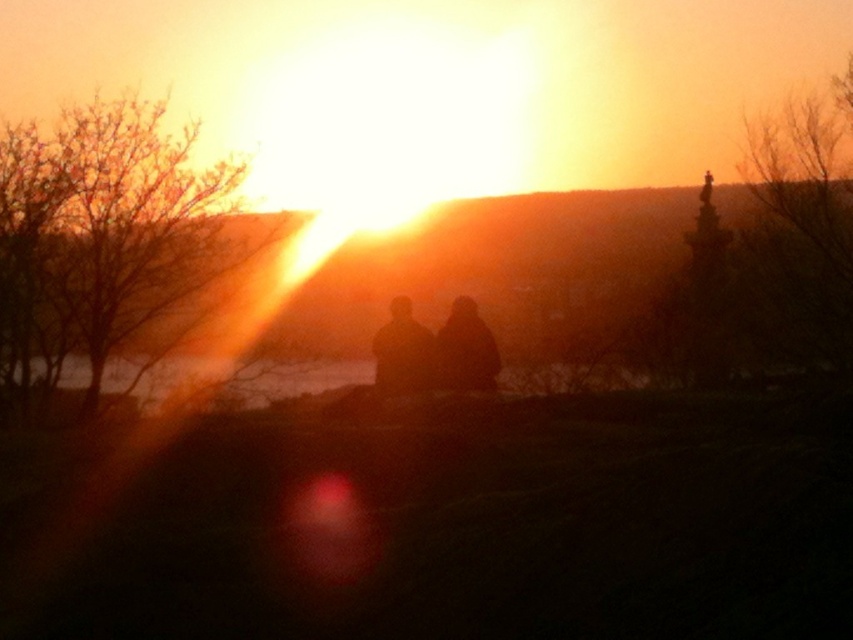
Question: Which is farther from the silhouette figures at center?

Choices:
 (A) silhouette figure at center
 (B) black matte figure at center

Answer: (A)

Question: Is silhouette figures at center to the right of black matte figure at center from the viewer's perspective?

Choices:
 (A) no
 (B) yes

Answer: (B)

Question: In this image, where is silhouette figures at center located relative to black matte figure at center?

Choices:
 (A) left
 (B) right

Answer: (B)

Question: Which object is the closest to the black matte figure at center?

Choices:
 (A) silhouette figure at center
 (B) silhouette figures at center

Answer: (B)

Question: Among these points, which one is farthest from the camera?

Choices:
 (A) (480, 376)
 (B) (416, 324)
 (C) (460, 348)

Answer: (B)

Question: Is silhouette figures at center wider than silhouette figure at center?

Choices:
 (A) yes
 (B) no

Answer: (A)